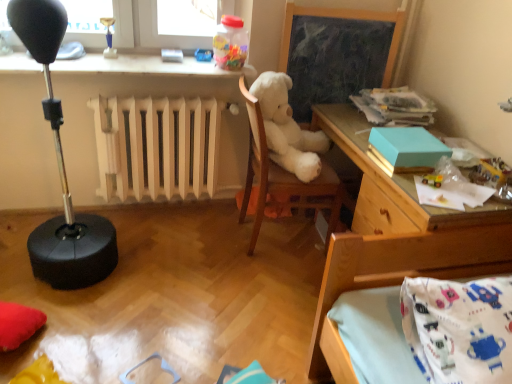
Question: Does metallic yellow toy car at upper right, the fourth toy when ordered from back to front, have a lesser width compared to wooden chalkboard at center?

Choices:
 (A) no
 (B) yes

Answer: (A)

Question: Would you say wooden chalkboard at center is part of metallic yellow toy car at upper right, the fourth toy when ordered from back to front,'s contents?

Choices:
 (A) no
 (B) yes

Answer: (A)

Question: From a real-world perspective, is metallic yellow toy car at upper right, which ranks as the second toy in right-to-left order, below wooden chalkboard at center?

Choices:
 (A) yes
 (B) no

Answer: (B)

Question: Is metallic yellow toy car at upper right, which ranks as the fourth toy in top-to-bottom order, turned away from wooden chalkboard at center?

Choices:
 (A) no
 (B) yes

Answer: (A)

Question: Does metallic yellow toy car at upper right, which ranks as the fourth toy in top-to-bottom order, appear on the left side of wooden chalkboard at center?

Choices:
 (A) no
 (B) yes

Answer: (A)

Question: Is white plush at center in front of or behind wooden chalkboard at center in the image?

Choices:
 (A) front
 (B) behind

Answer: (A)

Question: Does point (293, 203) appear closer or farther from the camera than point (375, 38)?

Choices:
 (A) farther
 (B) closer

Answer: (B)

Question: Looking at the image, does white plush at center seem bigger or smaller compared to wooden chalkboard at center?

Choices:
 (A) small
 (B) big

Answer: (B)

Question: Looking at their shapes, would you say white plush at center is wider or thinner than wooden chalkboard at center?

Choices:
 (A) thin
 (B) wide

Answer: (B)

Question: Is wooden desk at right wider or thinner than translucent plastic container at upper center, which is the fourth toy in bottom-to-top order?

Choices:
 (A) thin
 (B) wide

Answer: (B)

Question: Would you say wooden desk at right is to the left or to the right of translucent plastic container at upper center, which is the fourth toy in bottom-to-top order, in the picture?

Choices:
 (A) left
 (B) right

Answer: (B)

Question: From the image's perspective, is wooden desk at right positioned above or below translucent plastic container at upper center, the 1th toy when ordered from top to bottom?

Choices:
 (A) above
 (B) below

Answer: (B)

Question: From their relative heights in the image, would you say wooden desk at right is taller or shorter than translucent plastic container at upper center, the 2th toy viewed from the back?

Choices:
 (A) short
 (B) tall

Answer: (B)

Question: From the image's perspective, relative to white plush at center, is translucent plastic container at upper center, which is the fourth toy in bottom-to-top order, above or below?

Choices:
 (A) above
 (B) below

Answer: (A)

Question: Is point (242, 49) positioned closer to the camera than point (301, 135)?

Choices:
 (A) closer
 (B) farther

Answer: (A)